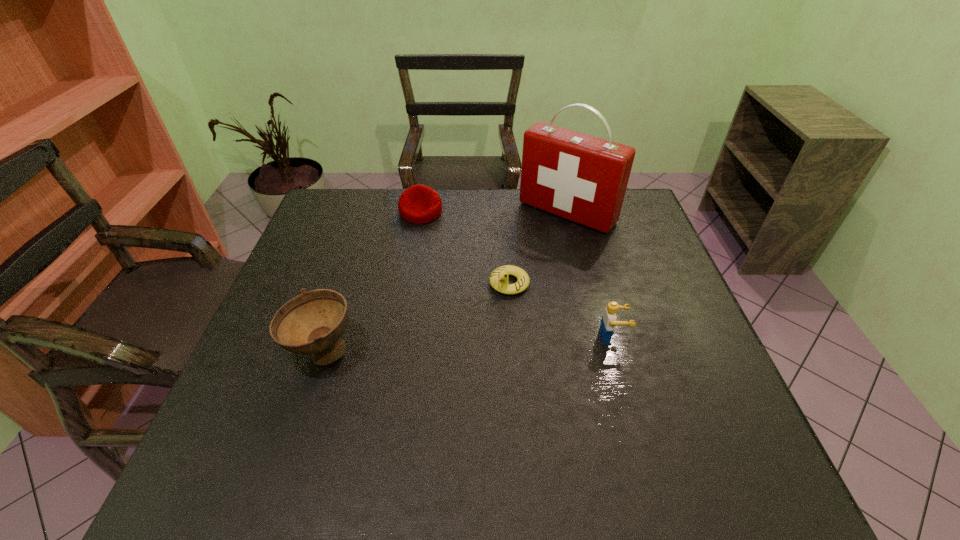
Where is `free space on the desktop that is between the leftmost object and the Lego and is positioned on the face of the duckling`? The height and width of the screenshot is (540, 960). free space on the desktop that is between the leftmost object and the Lego and is positioned on the face of the duckling is located at coordinates (451, 346).

Locate an element on the screen. Image resolution: width=960 pixels, height=540 pixels. free space on the desktop that is between the fourth shortest object and the Lego and is positioned on the front face of the first-aid kit is located at coordinates (440, 347).

I want to click on free space on the desktop that is between the leftmost object and the Lego and is positioned on the seat area of the second object from left to right, so click(426, 347).